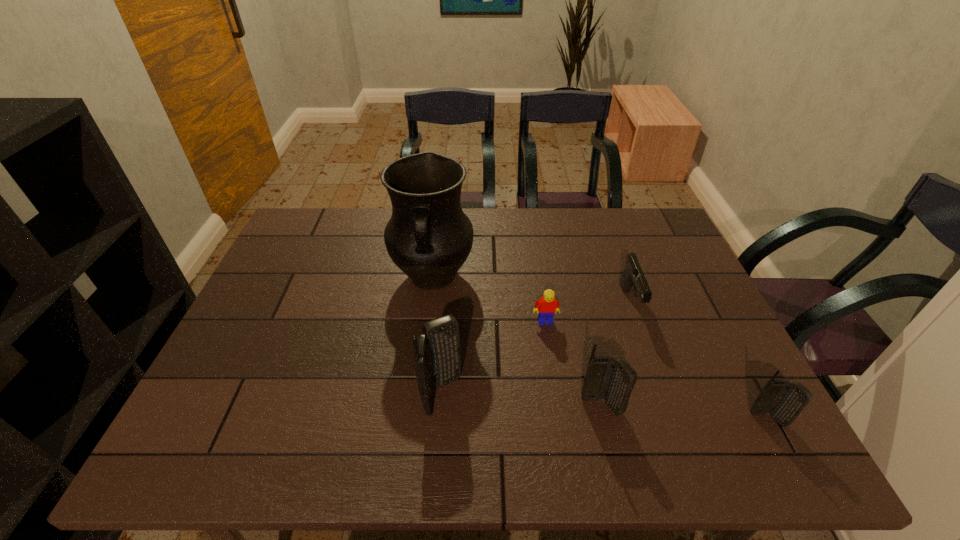
Please point a vacant point for placing a cellular telephone on the left. Please provide its 2D coordinates. Your answer should be formatted as a tuple, i.e. [(x, y)], where the tuple contains the x and y coordinates of a point satisfying the conditions above.

[(291, 382)]